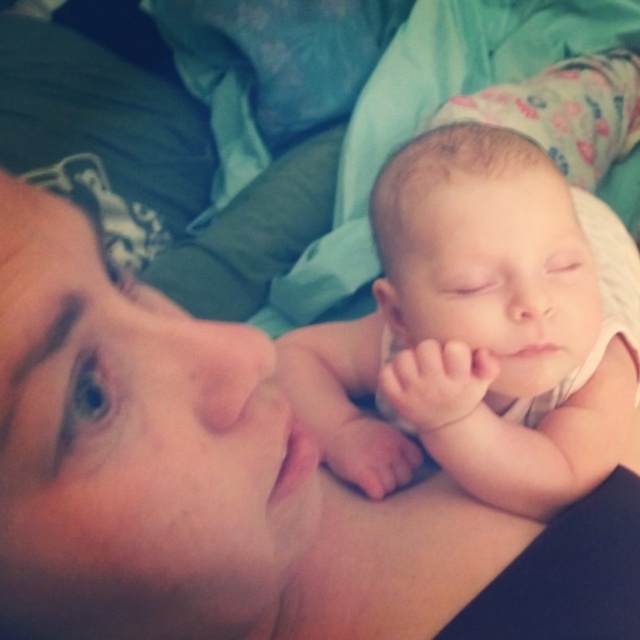
What do you see at coordinates (237, 486) in the screenshot? I see `smooth skin baby at center` at bounding box center [237, 486].

Is smooth skin baby at center to the left of smooth skin newborn at center from the viewer's perspective?

Correct, you'll find smooth skin baby at center to the left of smooth skin newborn at center.

Who is more forward, (236, 506) or (547, 349)?

Point (236, 506) is more forward.

Identify the location of smooth skin baby at center. (237, 486).